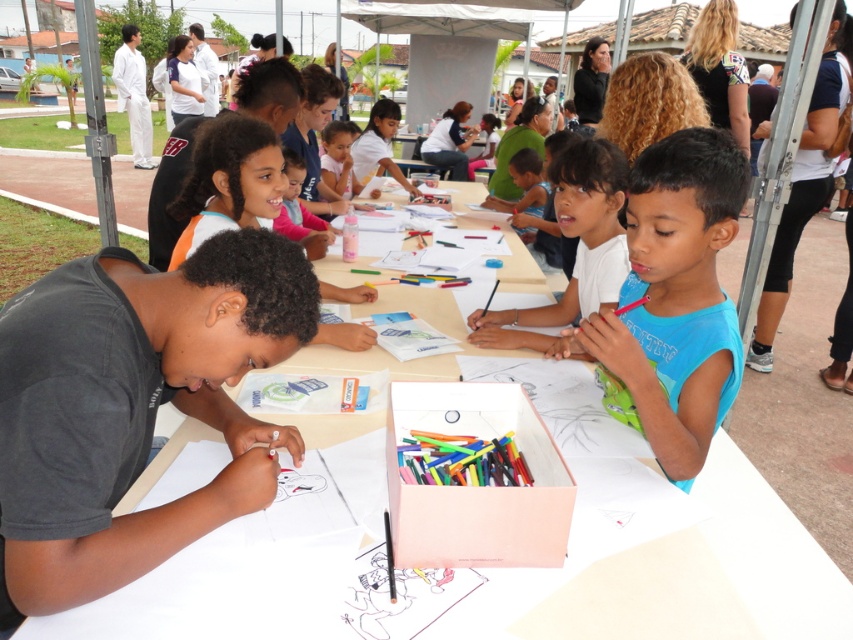
Does blue cotton shirt at center have a lesser width compared to matte pink shirt at center?

Incorrect, blue cotton shirt at center's width is not less than matte pink shirt at center's.

Between point (711, 385) and point (323, 163), which one is positioned in front?

Positioned in front is point (711, 385).

The height and width of the screenshot is (640, 853). I want to click on blue cotton shirt at center, so click(672, 301).

Which of these two, white paper at center or blue cotton shirt at center, stands shorter?

With less height is white paper at center.

Is point (169, 420) less distant than point (724, 214)?

No.

The image size is (853, 640). In order to click on white paper at center in this screenshot , I will do `click(718, 570)`.

Can you confirm if white paper at center is wider than matte pink shirt at center?

Correct, the width of white paper at center exceeds that of matte pink shirt at center.

Is white paper at center below matte pink shirt at center?

Yes.

Is point (843, 579) more distant than point (337, 161)?

No, (843, 579) is in front of (337, 161).

You are a GUI agent. You are given a task and a screenshot of the screen. Output one action in this format:
    pyautogui.click(x=<x>, y=<y>)
    Task: Click on the white paper at center
    This screenshot has width=853, height=640.
    Given the screenshot: What is the action you would take?
    pyautogui.click(x=718, y=570)